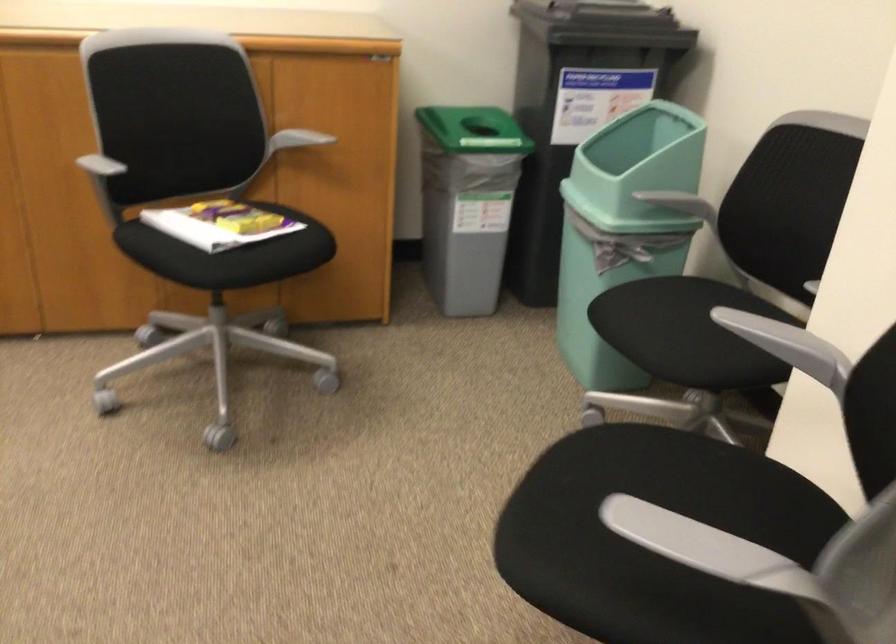
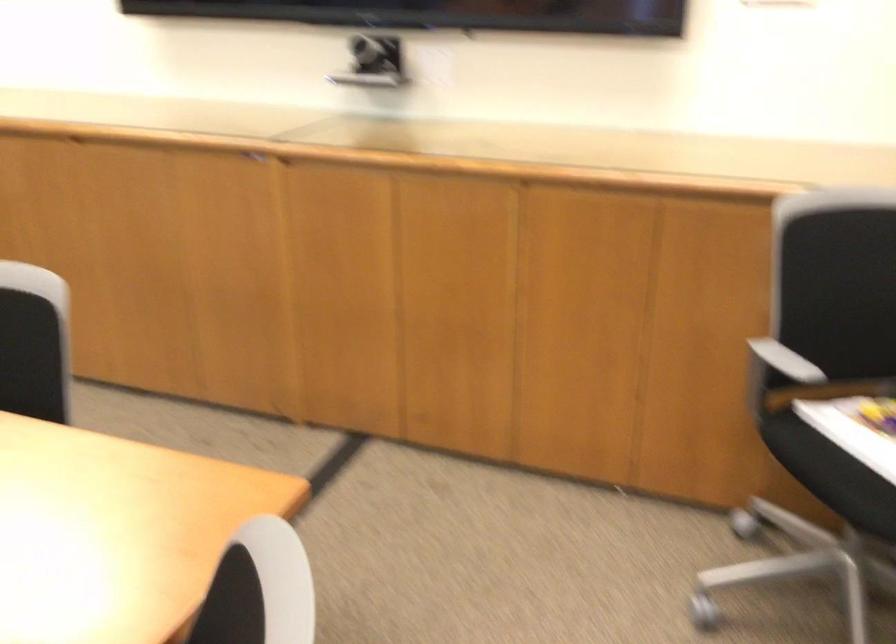
Question: The camera is either moving clockwise (left) or counter-clockwise (right) around the object. The first image is from the beginning of the video and the second image is from the end. Is the camera moving left or right when shooting the video?

Choices:
 (A) Left
 (B) Right

Answer: (B)